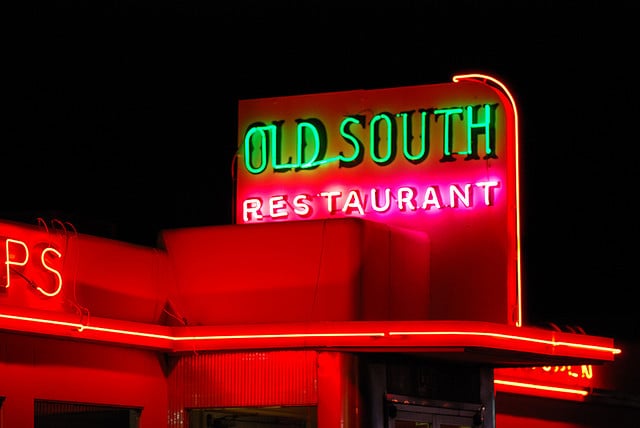
The width and height of the screenshot is (640, 428). Find the location of `door frame`. door frame is located at coordinates (419, 419), (441, 421).